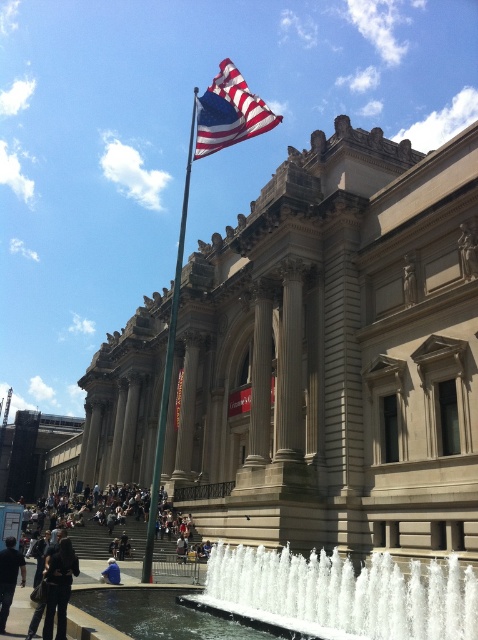
You are a photographer planning to capture a photo of the grand neoclassical building. You notice dark gray pants at lower left and blue denim jeans at lower center in the foreground. Which clothing item should you avoid including in your composition to ensure the focus remains on the building? Explain your reasoning based on their widths.

The dark gray pants at lower left should be avoided because its width surpasses that of the blue denim jeans at lower center, making it more prominent and potentially distracting from the building.

You are a photographer standing in front of the grand neoclassical building. You see a dark brown leather jacket at lower left and blue denim jeans at lower center. Which object is located to the right of the other?

The dark brown leather jacket at lower left is positioned on the right side of blue denim jeans at lower center, so the dark brown leather jacket at lower left is to the right of the blue denim jeans at lower center.